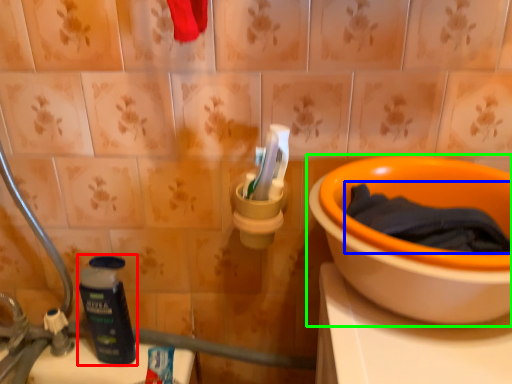
Question: Estimate the real-world distances between objects in this image. Which object is farther from bottle (highlighted by a red box), bath towel (highlighted by a blue box) or toilet (highlighted by a green box)?

Choices:
 (A) bath towel
 (B) toilet

Answer: (A)